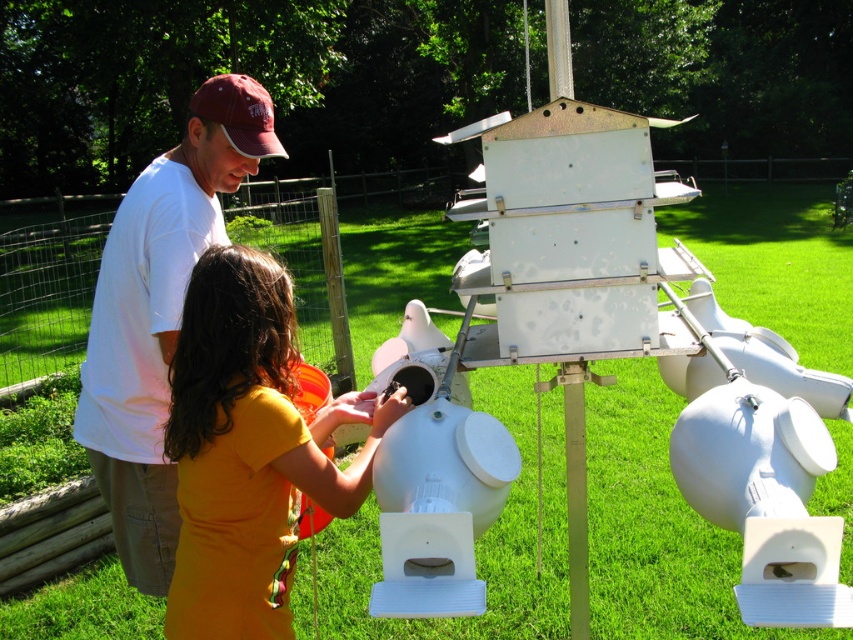
Question: Considering the relative positions of yellow matte shirt at center and white matte shirt at upper left in the image provided, where is yellow matte shirt at center located with respect to white matte shirt at upper left?

Choices:
 (A) left
 (B) right

Answer: (B)

Question: Does yellow matte shirt at center have a larger size compared to white matte shirt at upper left?

Choices:
 (A) yes
 (B) no

Answer: (B)

Question: Can you confirm if yellow matte shirt at center is bigger than white matte shirt at upper left?

Choices:
 (A) yes
 (B) no

Answer: (B)

Question: Which point is farther to the camera?

Choices:
 (A) (276, 353)
 (B) (113, 387)

Answer: (B)